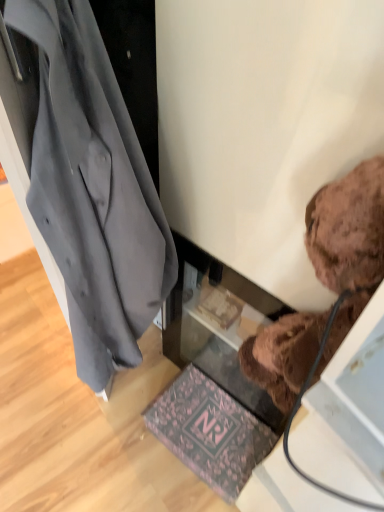
Identify the location of free location to the left of pink floral mat at lower center. This screenshot has width=384, height=512. (119, 441).